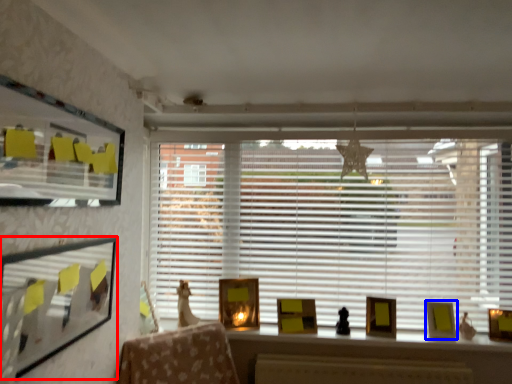
Question: Which of the following is the closest to the observer, picture frame (highlighted by a red box) or picture frame (highlighted by a blue box)?

Choices:
 (A) picture frame
 (B) picture frame

Answer: (A)